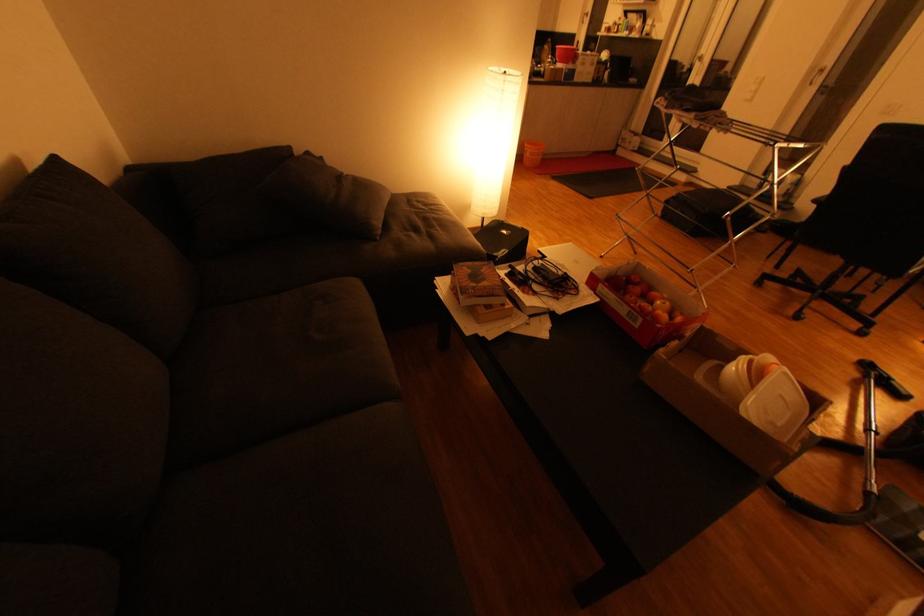
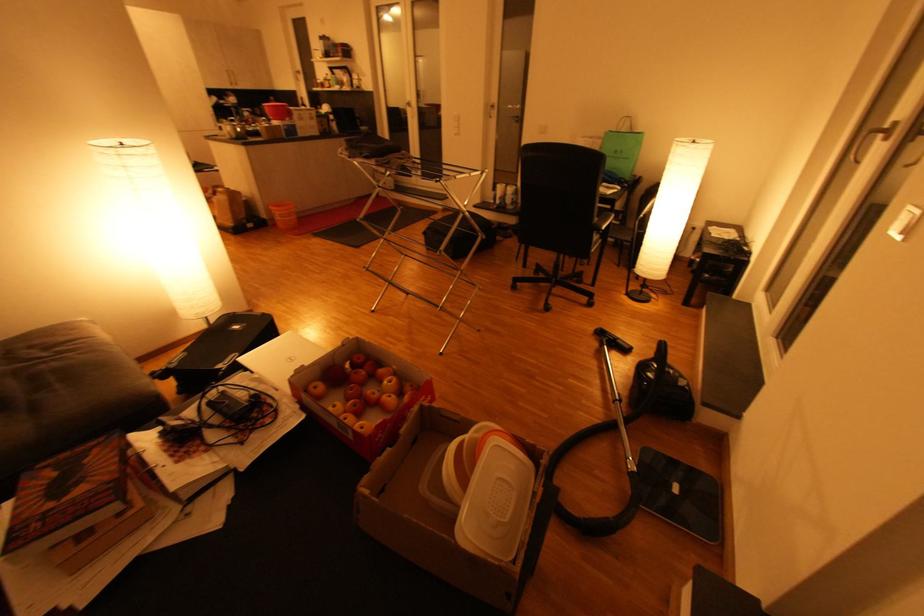
Where in the second image is the point corresponding to the point at 785,397 from the first image?

(504, 479)